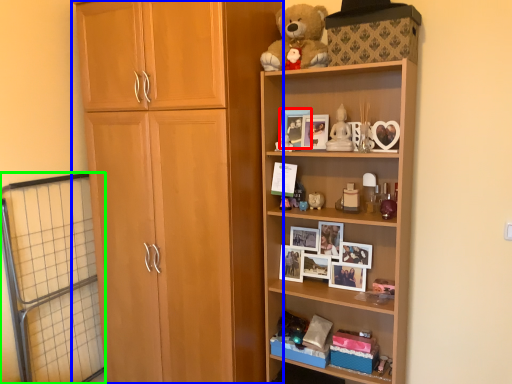
Question: Estimate the real-world distances between objects in this image. Which object is closer to picture frame (highlighted by a red box), cupboard (highlighted by a blue box) or screen door (highlighted by a green box)?

Choices:
 (A) cupboard
 (B) screen door

Answer: (A)